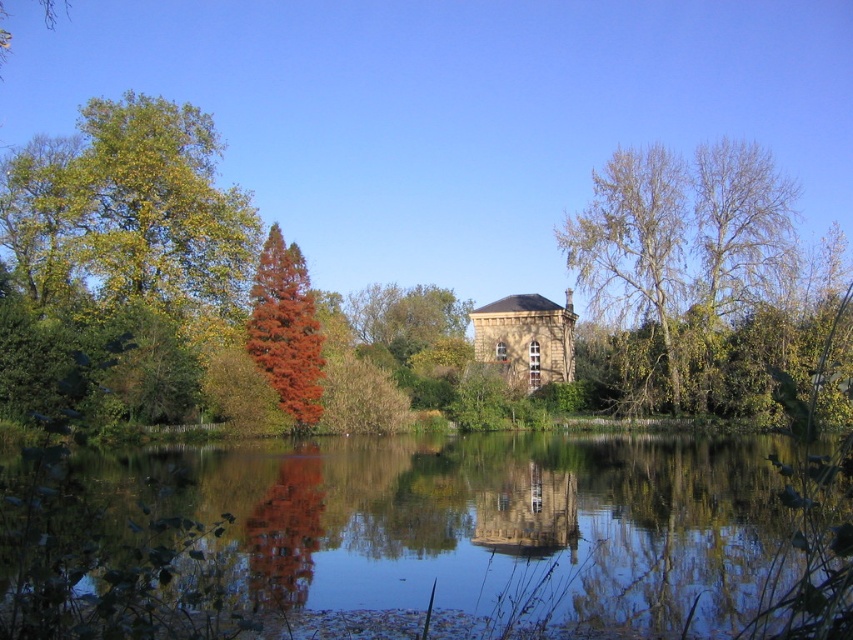
You are standing on the bank of the pond and see the transparent water at center and the smooth stone tower at center. Which object is closer to you?

The transparent water at center is closer to you because it is above the smooth stone tower at center, meaning the tower is submerged underwater and the water is the surface layer you see first.

You are a photographer standing at the edge of the pond and want to capture both the red tree and the bare trees in your shot. You notice two points marked on your camera screen at coordinates point (643, 198) and point (502, 509). Which point should you focus on to ensure both the red tree and the bare trees are in sharp focus?

You should focus on point (643, 198) because it is closer to the camera than point (502, 509). This will ensure that both the red tree and the bare trees are within the depth of field and appear sharp in the photo.